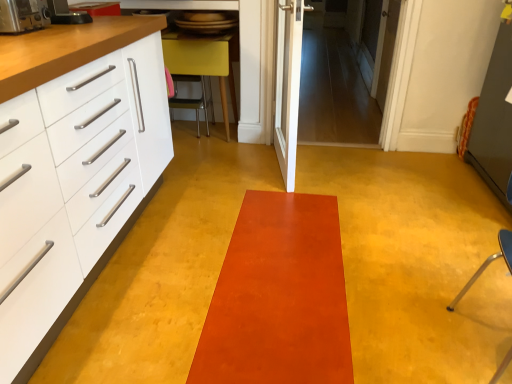
Locate an element on the screen. free space underneath blue plastic chair at right, the second furniture viewed from the back (from a real-world perspective) is located at coordinates (485, 339).